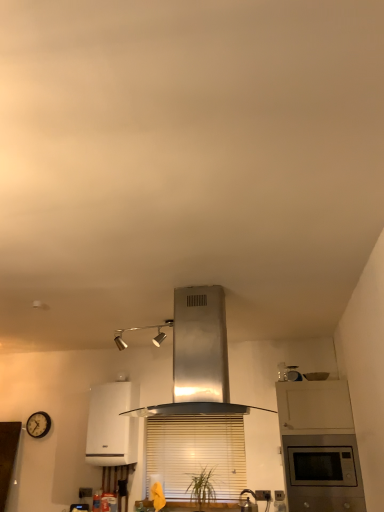
Question: Can you confirm if wooden blinds at center is shorter than satin silver kettle at lower center?

Choices:
 (A) no
 (B) yes

Answer: (A)

Question: Can you confirm if wooden blinds at center is taller than satin silver kettle at lower center?

Choices:
 (A) yes
 (B) no

Answer: (A)

Question: From a real-world perspective, is wooden blinds at center under satin silver kettle at lower center?

Choices:
 (A) no
 (B) yes

Answer: (A)

Question: Is wooden blinds at center not within satin silver kettle at lower center?

Choices:
 (A) yes
 (B) no

Answer: (A)

Question: Does wooden blinds at center have a smaller size compared to satin silver kettle at lower center?

Choices:
 (A) yes
 (B) no

Answer: (B)

Question: Does wooden blinds at center have a lesser width compared to satin silver kettle at lower center?

Choices:
 (A) yes
 (B) no

Answer: (A)

Question: Is wooden blinds at center positioned beyond the bounds of stainless steel range hood at center, acting as the first home appliance starting from the right?

Choices:
 (A) no
 (B) yes

Answer: (B)

Question: From a real-world perspective, is wooden blinds at center located beneath stainless steel range hood at center, the second home appliance in the bottom-to-top sequence?

Choices:
 (A) yes
 (B) no

Answer: (A)

Question: Could you tell me if wooden blinds at center is facing stainless steel range hood at center, which appears as the first home appliance when viewed from the top?

Choices:
 (A) yes
 (B) no

Answer: (A)

Question: Does wooden blinds at center have a smaller size compared to stainless steel range hood at center, acting as the first home appliance starting from the right?

Choices:
 (A) no
 (B) yes

Answer: (B)

Question: Is wooden blinds at center wider than stainless steel range hood at center, which ranks as the 2th home appliance in left-to-right order?

Choices:
 (A) no
 (B) yes

Answer: (A)

Question: Is wooden blinds at center turned away from stainless steel range hood at center, the second home appliance positioned from the back?

Choices:
 (A) no
 (B) yes

Answer: (A)

Question: Is wooden blinds at center shorter than wooden clock at lower left?

Choices:
 (A) no
 (B) yes

Answer: (A)